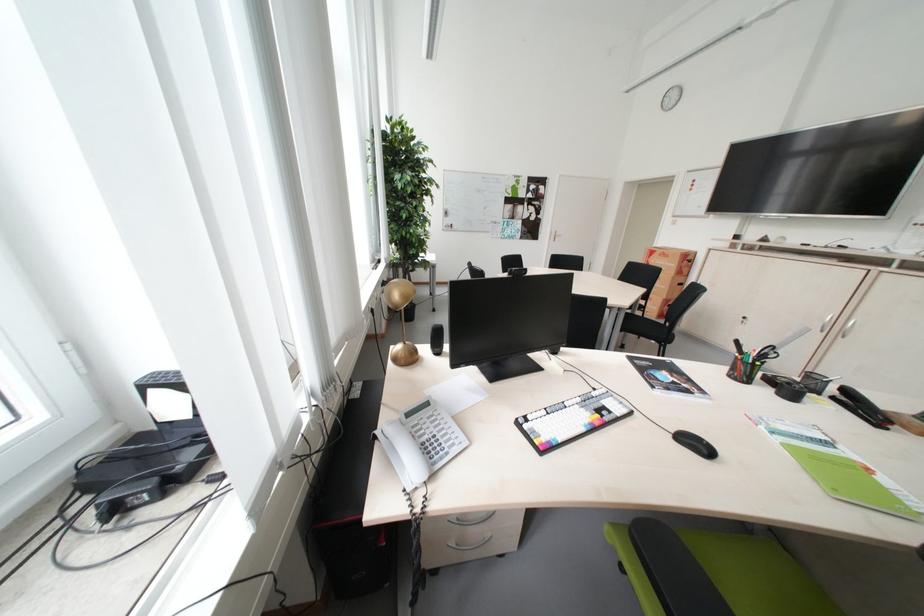
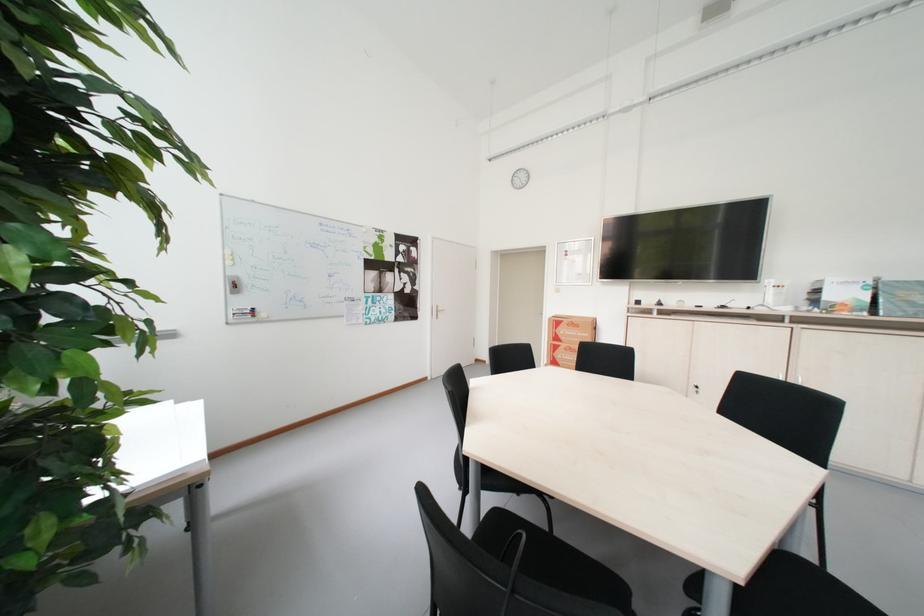
Locate, in the second image, the point that corresponds to (554,230) in the first image.

(434, 305)